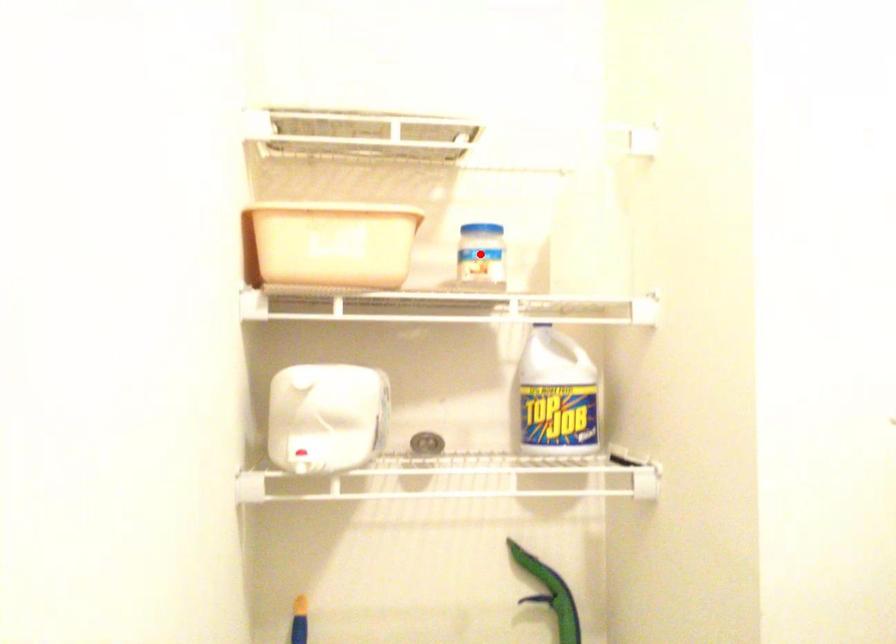
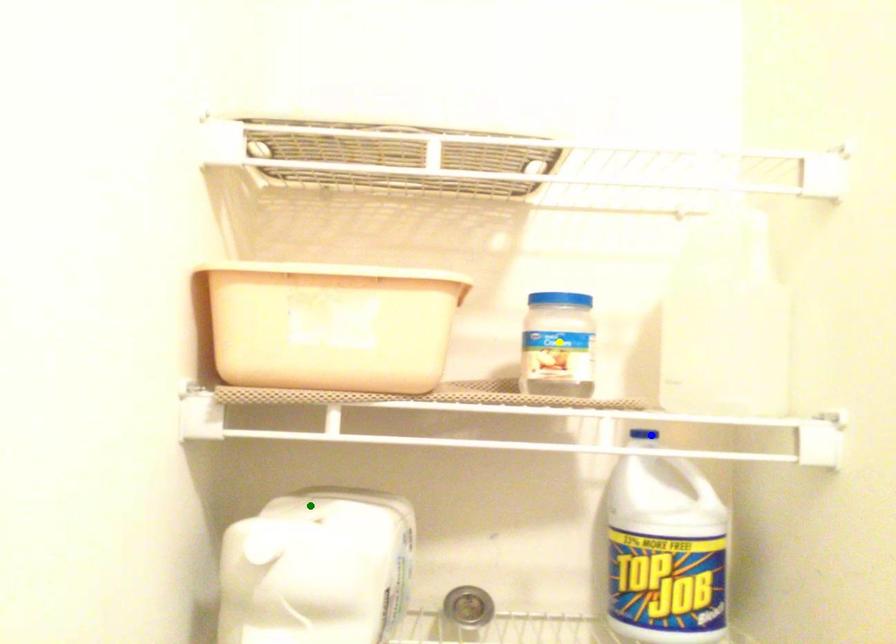
Question: I am providing you with two images of the same scene from different viewpoints. A red point is marked on the first image. You are given multiple points on the second image. Which mark in image 2 goes with the point in image 1?

Choices:
 (A) yellow point
 (B) blue point
 (C) green point

Answer: (A)